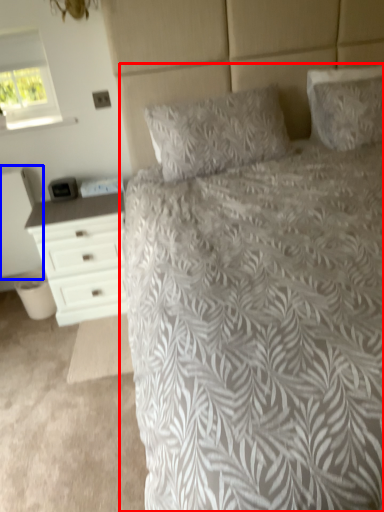
Question: Which of the following is the farthest to the observer, bed (highlighted by a red box) or nightstand (highlighted by a blue box)?

Choices:
 (A) bed
 (B) nightstand

Answer: (B)